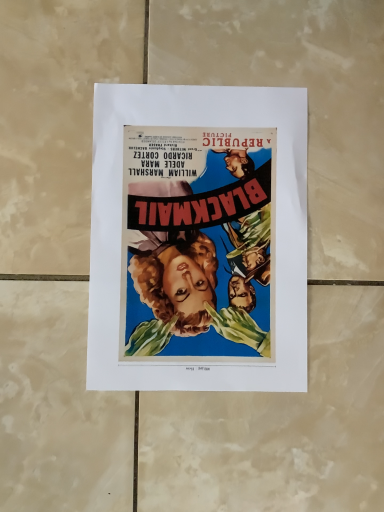
The image size is (384, 512). In order to click on free point above watercolor painting of a movie poster at center (from a real-world perspective) in this screenshot , I will do `click(199, 238)`.